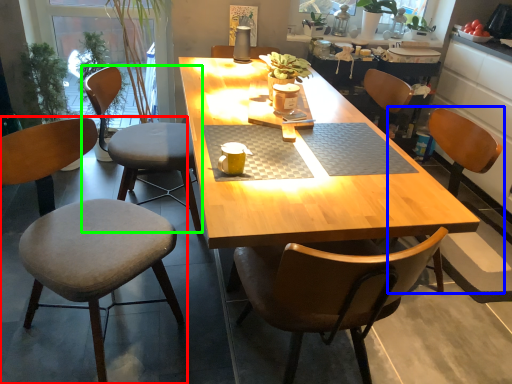
Question: Considering the real-world distances, which object is farthest from chair (highlighted by a red box)? chair (highlighted by a blue box) or chair (highlighted by a green box)?

Choices:
 (A) chair
 (B) chair

Answer: (A)